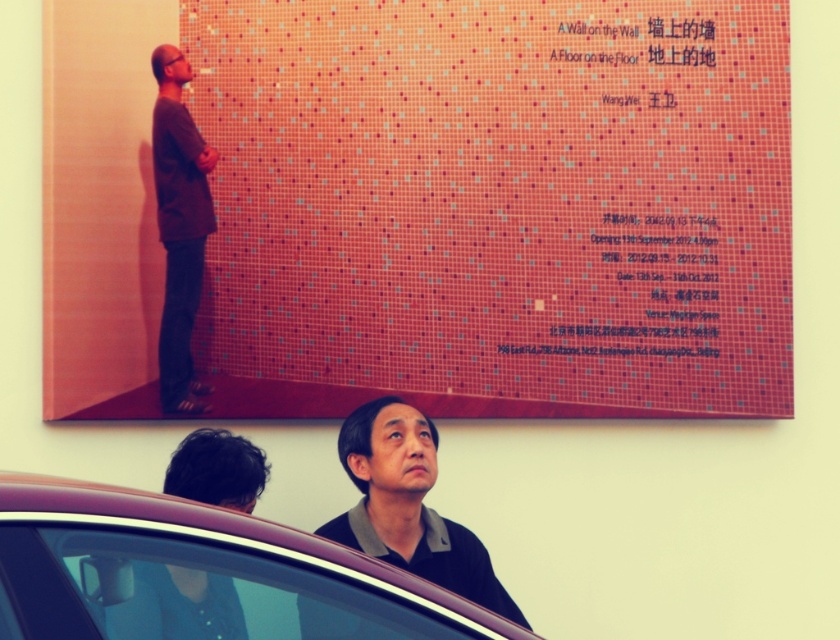
You are standing in the art gallery and notice two people in the scene. One is wearing a black matte shirt at center and the other has dark brown hair at upper center. Which of these two has a feature that is taller?

The black matte shirt at center is taller than the dark brown hair at upper center.

You are standing in the art gallery and notice the metallic car at lower center and the brown matte sweater at upper left. Based on their positions, which object is closer to the ceiling?

The brown matte sweater at upper left is closer to the ceiling because it is positioned above the metallic car at lower center.